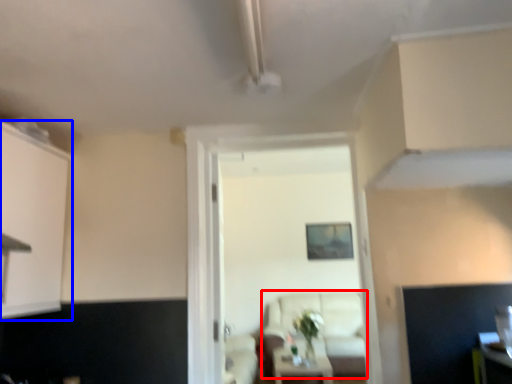
Question: Which object is further to the camera taking this photo, couch (highlighted by a red box) or cabinetry (highlighted by a blue box)?

Choices:
 (A) couch
 (B) cabinetry

Answer: (A)